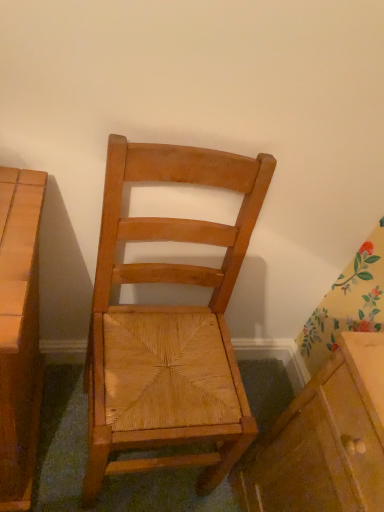
What do you see at coordinates (325, 439) in the screenshot? I see `matte wood cabinet at lower right` at bounding box center [325, 439].

Identify the location of matte wood cabinet at lower right. (325, 439).

This screenshot has width=384, height=512. I want to click on natural wood chair at center, so click(168, 322).

What is the approximate width of natural wood chair at center?

natural wood chair at center is 47.45 centimeters wide.

Describe the element at coordinates (168, 322) in the screenshot. I see `natural wood chair at center` at that location.

Find the location of `matte wood cabinet at lower right`. matte wood cabinet at lower right is located at coordinates (325, 439).

Which is more to the left, natural wood chair at center or matte wood cabinet at lower right?

natural wood chair at center is more to the left.

Considering the positions of objects natural wood chair at center and matte wood cabinet at lower right in the image provided, who is behind, natural wood chair at center or matte wood cabinet at lower right?

matte wood cabinet at lower right is further from the camera.

Which point is more distant from viewer, (105, 397) or (383, 381)?

The point (105, 397) is more distant.

From the image's perspective, who appears lower, natural wood chair at center or matte wood cabinet at lower right?

matte wood cabinet at lower right appears lower in the image.

From the picture: From a real-world perspective, is natural wood chair at center on matte wood cabinet at lower right?

Yes, from a real-world perspective, natural wood chair at center is over matte wood cabinet at lower right

Considering the relative sizes of natural wood chair at center and matte wood cabinet at lower right in the image provided, is natural wood chair at center wider than matte wood cabinet at lower right?

Yes.

Considering the sizes of natural wood chair at center and matte wood cabinet at lower right in the image, is natural wood chair at center taller or shorter than matte wood cabinet at lower right?

In the image, natural wood chair at center appears to be taller than matte wood cabinet at lower right.

Considering the sizes of natural wood chair at center and matte wood cabinet at lower right in the image, is natural wood chair at center bigger or smaller than matte wood cabinet at lower right?

natural wood chair at center is bigger than matte wood cabinet at lower right.

Can we say natural wood chair at center lies outside matte wood cabinet at lower right?

That's correct, natural wood chair at center is outside of matte wood cabinet at lower right.

Is natural wood chair at center directly adjacent to matte wood cabinet at lower right?

No, natural wood chair at center is not next to matte wood cabinet at lower right.

Is natural wood chair at center aimed at matte wood cabinet at lower right?

No, natural wood chair at center is not aimed at matte wood cabinet at lower right.

How many degrees apart are the facing directions of natural wood chair at center and matte wood cabinet at lower right?

The angular difference between natural wood chair at center and matte wood cabinet at lower right is 89.6 degrees.

Identify the location of cabinetry below the natural wood chair at center (from the image's perspective). (325, 439).

Considering the positions of objects matte wood cabinet at lower right and natural wood chair at center in the image provided, who is more to the left, matte wood cabinet at lower right or natural wood chair at center?

Positioned to the left is natural wood chair at center.

Is matte wood cabinet at lower right positioned behind natural wood chair at center?

Yes, it is.

Considering the points (273, 436) and (91, 428), which point is in front, point (273, 436) or point (91, 428)?

The point (91, 428) is closer to the camera.

From the image's perspective, is matte wood cabinet at lower right located above natural wood chair at center?

Incorrect, from the image's perspective, matte wood cabinet at lower right is lower than natural wood chair at center.

From a real-world perspective, is matte wood cabinet at lower right on natural wood chair at center?

No.

Does matte wood cabinet at lower right have a lesser width compared to natural wood chair at center?

Indeed, matte wood cabinet at lower right has a lesser width compared to natural wood chair at center.

Who is taller, matte wood cabinet at lower right or natural wood chair at center?

With more height is natural wood chair at center.

Does matte wood cabinet at lower right have a smaller size compared to natural wood chair at center?

Correct, matte wood cabinet at lower right occupies less space than natural wood chair at center.

Is matte wood cabinet at lower right not within natural wood chair at center?

matte wood cabinet at lower right lies outside natural wood chair at center's area.

Looking at this image, is matte wood cabinet at lower right next to natural wood chair at center?

matte wood cabinet at lower right and natural wood chair at center are not in contact.

Is matte wood cabinet at lower right facing away from natural wood chair at center?

No, matte wood cabinet at lower right is not facing the opposite direction of natural wood chair at center.

How different are the orientations of matte wood cabinet at lower right and natural wood chair at center in degrees?

matte wood cabinet at lower right and natural wood chair at center are facing 89.6 degrees away from each other.

I want to click on cabinetry that appears below the natural wood chair at center (from the image's perspective), so click(x=325, y=439).

The width and height of the screenshot is (384, 512). Identify the location of chair that appears on the left of matte wood cabinet at lower right. (168, 322).

The width and height of the screenshot is (384, 512). Find the location of `cabinetry on the right side of natural wood chair at center`. cabinetry on the right side of natural wood chair at center is located at coordinates (325, 439).